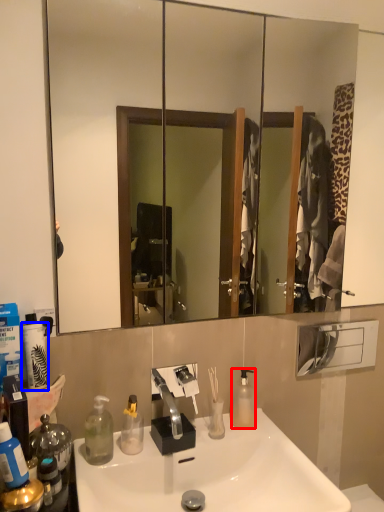
Question: Among these objects, which one is farthest to the camera, bottle (highlighted by a red box) or toilet paper (highlighted by a blue box)?

Choices:
 (A) bottle
 (B) toilet paper

Answer: (A)